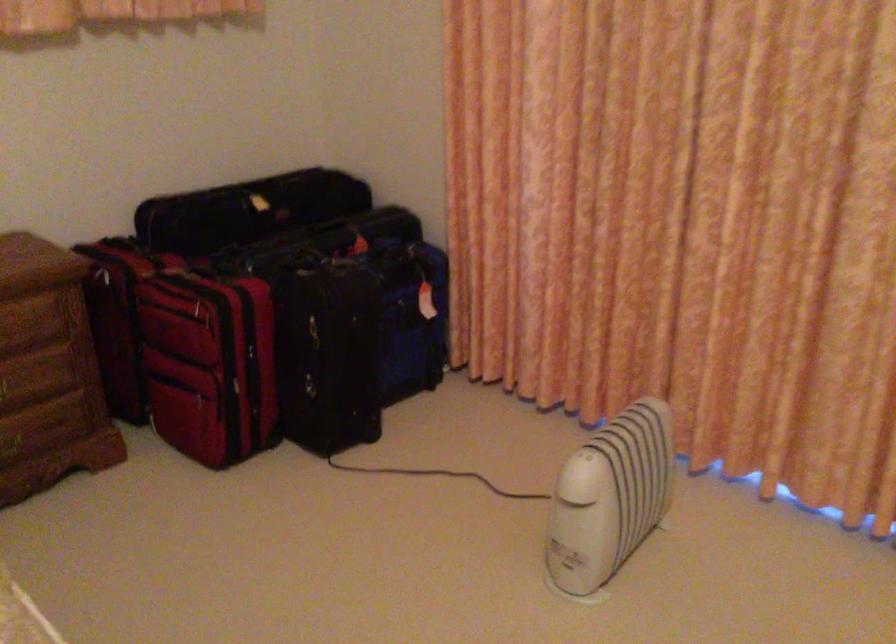
Find where to lift the blue suitcase handle. Please return your answer as a coordinate pair (x, y).

(209, 364)